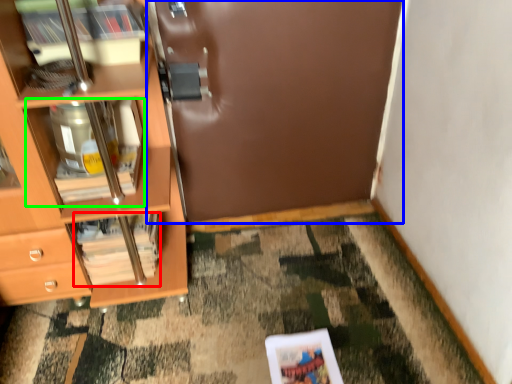
Question: Which object is positioned closest to magazine (highlighted by a red box)? Select from door (highlighted by a blue box) and cabinet (highlighted by a green box).

Choices:
 (A) door
 (B) cabinet

Answer: (B)